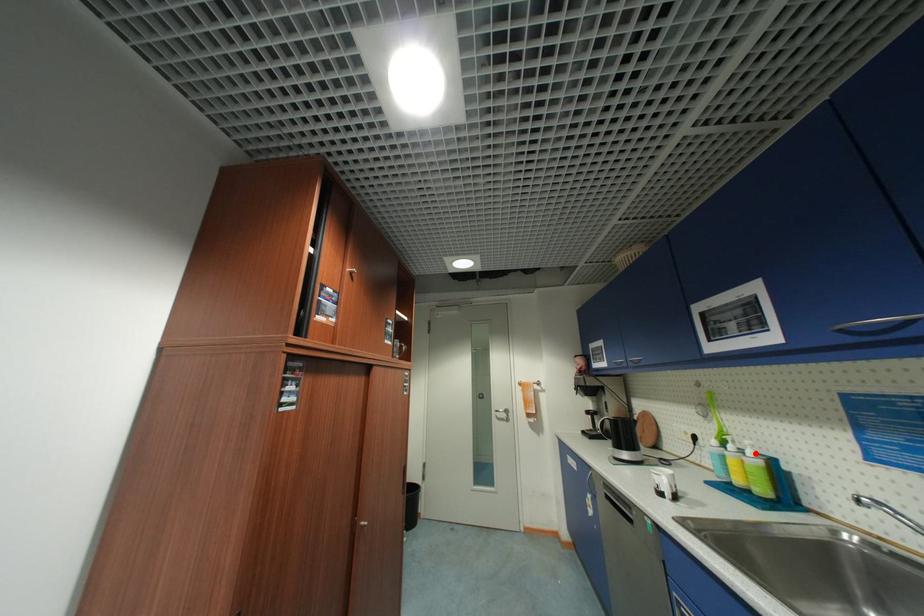
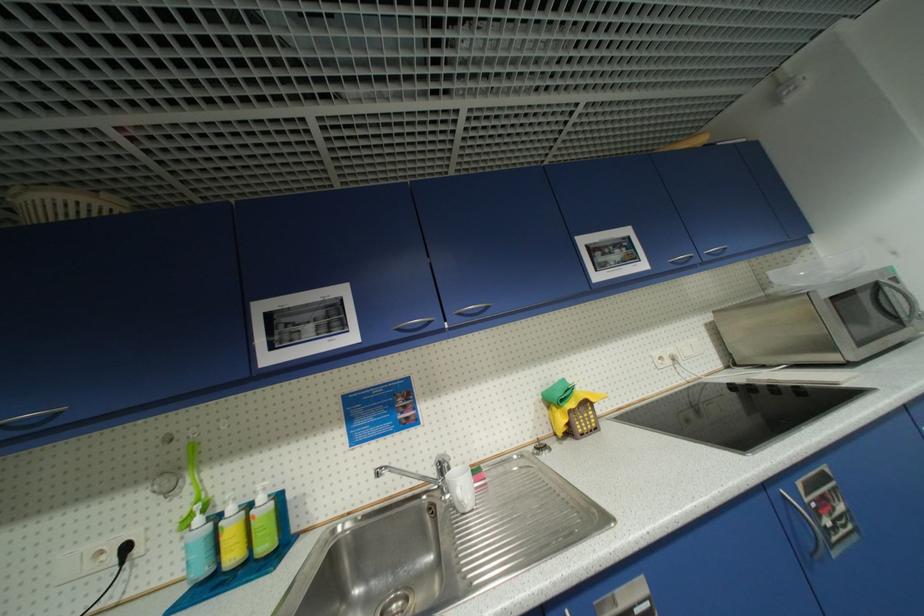
Find the pixel in the second image that matches the highlighted location in the first image.

(266, 500)